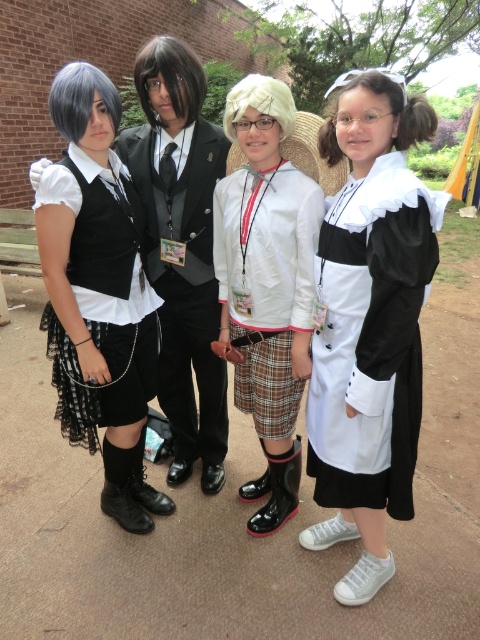
You are trying to decide which item to take with you from the white matte dress at center and the white matte jacket at center. If you can only carry one item, which one should you choose based on their height?

The white matte dress at center is not as tall as the white matte jacket at center, so you should take the white matte jacket at center since it is taller and possibly more useful for covering your body.